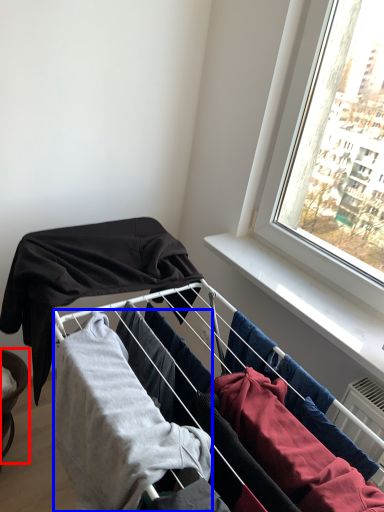
Question: Among these objects, which one is nearest to the camera, furniture (highlighted by a red box) or clothing (highlighted by a blue box)?

Choices:
 (A) furniture
 (B) clothing

Answer: (B)